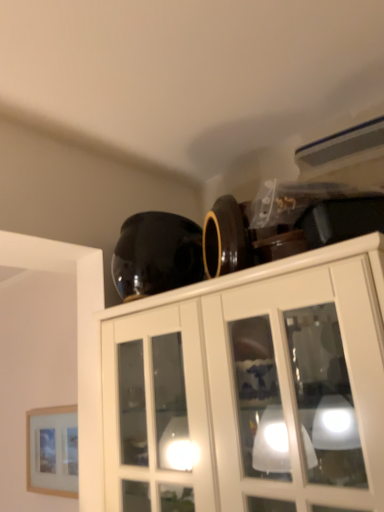
This screenshot has width=384, height=512. Identify the location of matte white cabinet at upper center. (251, 387).

Measure the distance between point (159, 459) and camera.

Point (159, 459) and camera are 37.64 inches apart.

What do you see at coordinates (251, 387) in the screenshot?
I see `matte white cabinet at upper center` at bounding box center [251, 387].

The image size is (384, 512). What are the coordinates of `matte white cabinet at upper center` in the screenshot? It's located at (251, 387).